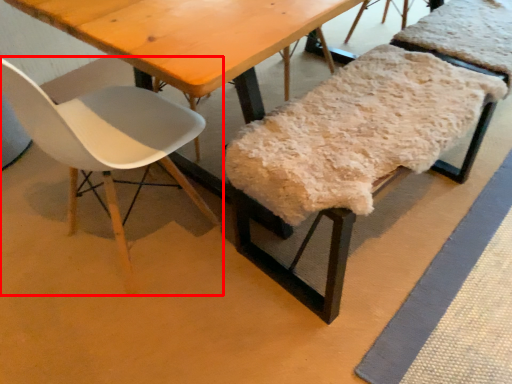
Question: From the image's perspective, where is chair (annotated by the red box) located relative to chair?

Choices:
 (A) below
 (B) above

Answer: (B)